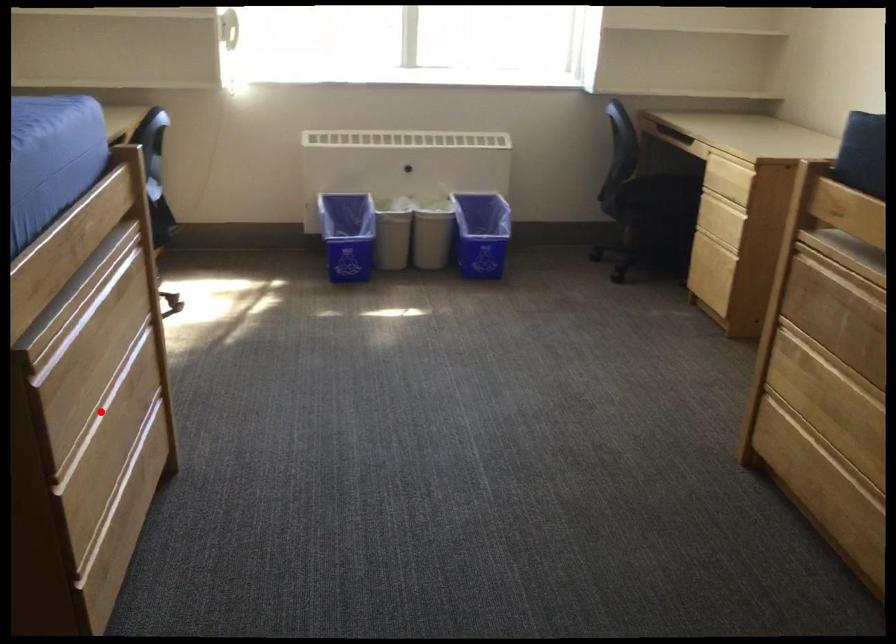
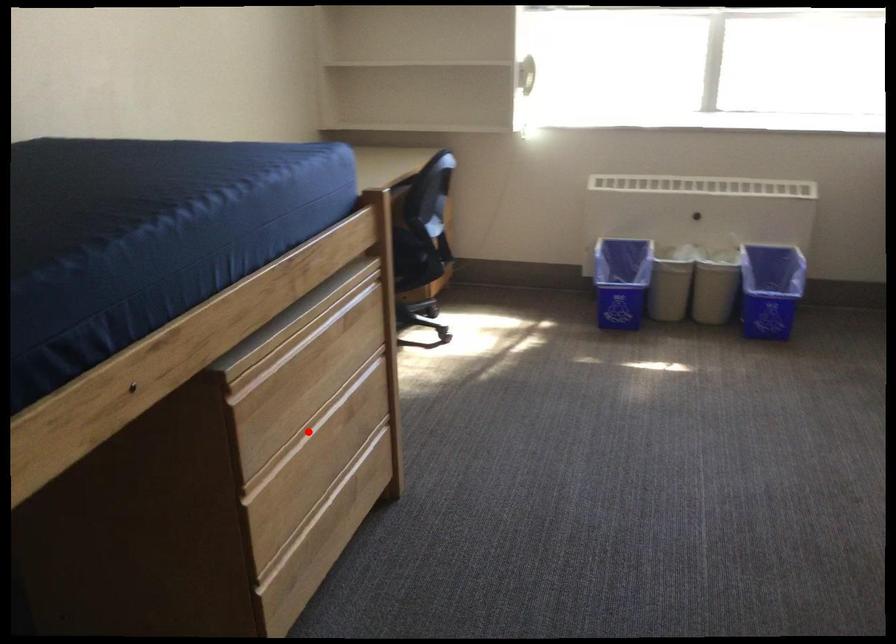
I am providing you with two images of the same scene from different viewpoints. A red point is marked on the first image and another point is marked on the second image. Do the highlighted points in image1 and image2 indicate the same real-world spot?

Yes